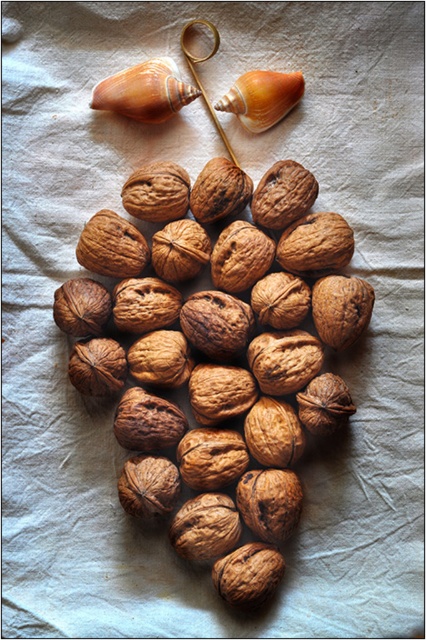
Question: Which of the following is the closest to the observer?

Choices:
 (A) matte brown seashell at upper center
 (B) matte brown shell at upper left

Answer: (B)

Question: Among these objects, which one is farthest from the camera?

Choices:
 (A) matte brown shell at upper left
 (B) matte brown seashell at upper center

Answer: (B)

Question: Which point is closer to the camera?

Choices:
 (A) matte brown seashell at upper center
 (B) matte brown shell at upper left

Answer: (B)

Question: In this image, where is matte brown shell at upper left located relative to matte brown seashell at upper center?

Choices:
 (A) left
 (B) right

Answer: (A)

Question: Does matte brown shell at upper left lie in front of matte brown seashell at upper center?

Choices:
 (A) no
 (B) yes

Answer: (B)

Question: Does matte brown shell at upper left have a greater width compared to matte brown seashell at upper center?

Choices:
 (A) yes
 (B) no

Answer: (A)